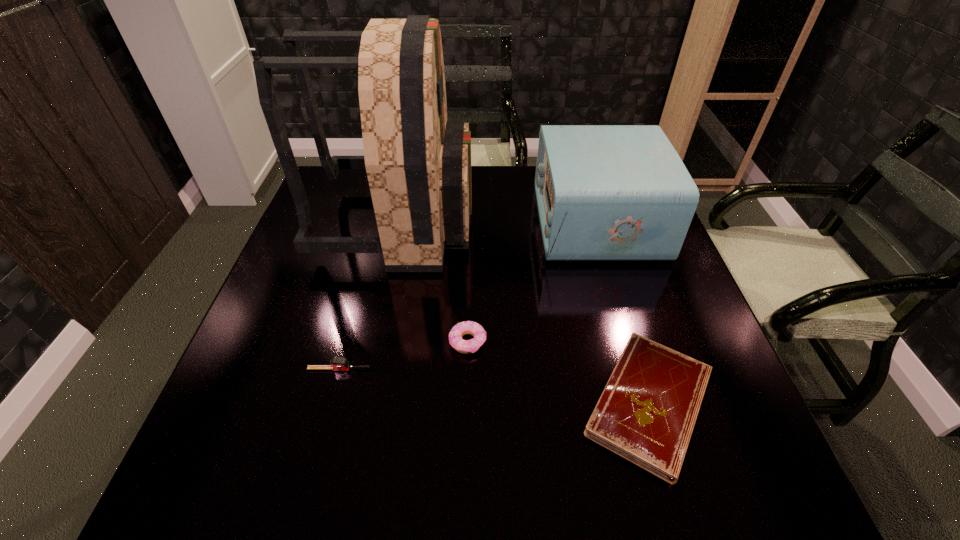
This screenshot has width=960, height=540. Find the location of `free spot located 0.050m on the back of the doughnut`. free spot located 0.050m on the back of the doughnut is located at coordinates (468, 310).

This screenshot has width=960, height=540. I want to click on vacant space located 0.350m on the back of the shortest object, so click(x=599, y=235).

At what (x,y) coordinates should I click in order to perform the action: click on backpack present at the far edge. Please return your answer as a coordinate pair (x, y). The width and height of the screenshot is (960, 540). Looking at the image, I should click on (418, 164).

Where is `radio receiver that is at the far edge`? radio receiver that is at the far edge is located at coordinates (604, 192).

Where is `object that is at the near edge`? object that is at the near edge is located at coordinates (647, 412).

The height and width of the screenshot is (540, 960). I want to click on backpack that is at the left edge, so click(x=418, y=164).

The image size is (960, 540). In order to click on tape measure that is at the left edge in this screenshot , I will do `click(336, 363)`.

Find the location of a particular element. Image resolution: width=960 pixels, height=540 pixels. radio receiver present at the right edge is located at coordinates (604, 192).

Locate an element on the screen. The image size is (960, 540). notebook present at the right edge is located at coordinates (647, 412).

This screenshot has width=960, height=540. I want to click on object situated at the far left corner, so click(418, 164).